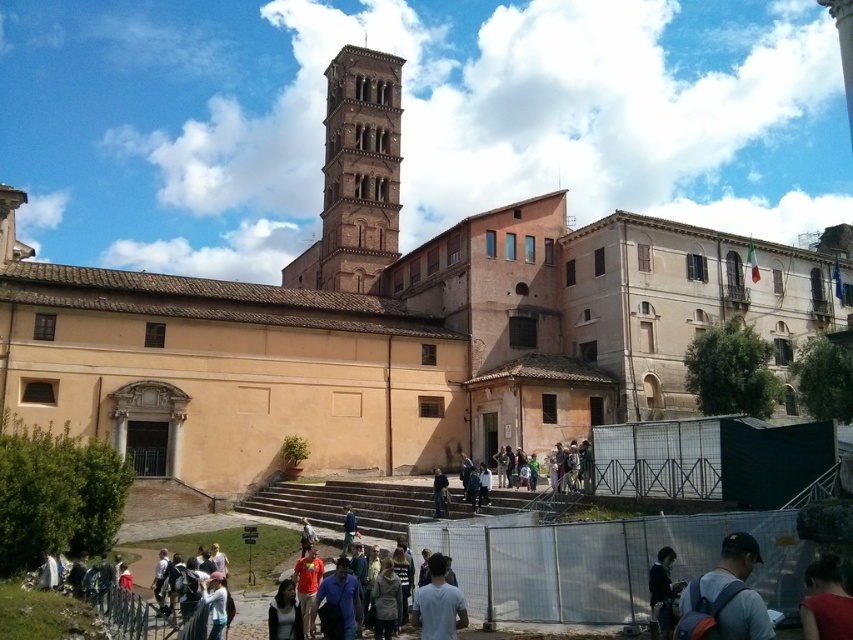
Based on the photo, you are a photographer trying to capture a photo of the bell tower. However, you notice two people in the foreground that might block your shot. The red fabric dress at lower right and the dark blue jeans at center are in your way. Which person should you move to ensure the bell tower is fully visible?

The red fabric dress at lower right is positioned over dark blue jeans at center, so moving the person wearing the red fabric dress at lower right would ensure the bell tower is fully visible.

You are a photographer standing at the lower right corner of the scene. You want to take a photo of the beige stone church at center while also including the dark blue fabric jacket at lower right in the frame. Is the church likely to be taller than the jacket in your photo?

The beige stone church at center is taller than the dark blue fabric jacket at lower right, so yes, the church will appear taller than the jacket in the photo.

You are a photographer standing at the center of the scene. You want to capture a photo that includes both the red fabric dress at lower right and the dark blue jeans at center. However, your camera has a limited zoom range. Based on their distance, can you estimate whether you can fit both subjects into the frame without moving closer?

The red fabric dress at lower right is 24.67 meters away from the dark blue jeans at center. Since they are relatively far apart, you might need to adjust your position or use a wider lens to ensure both are in the frame.